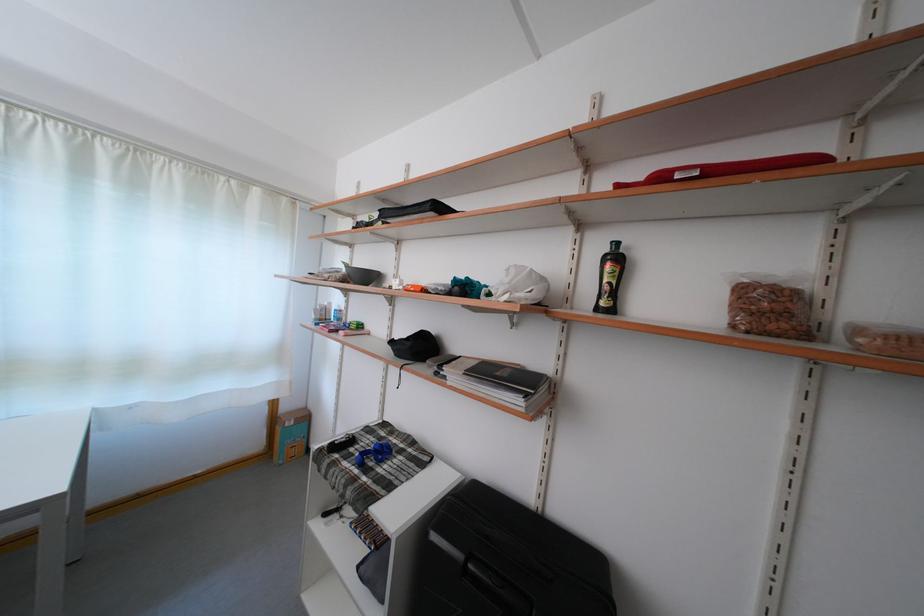
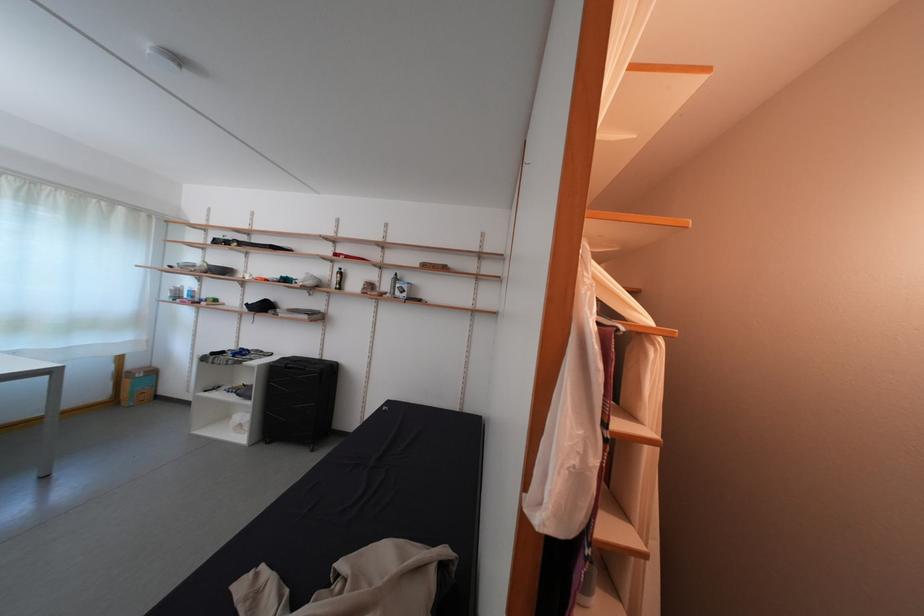
Find the pixel in the second image that matches the point at 293,415 in the first image.

(140, 371)